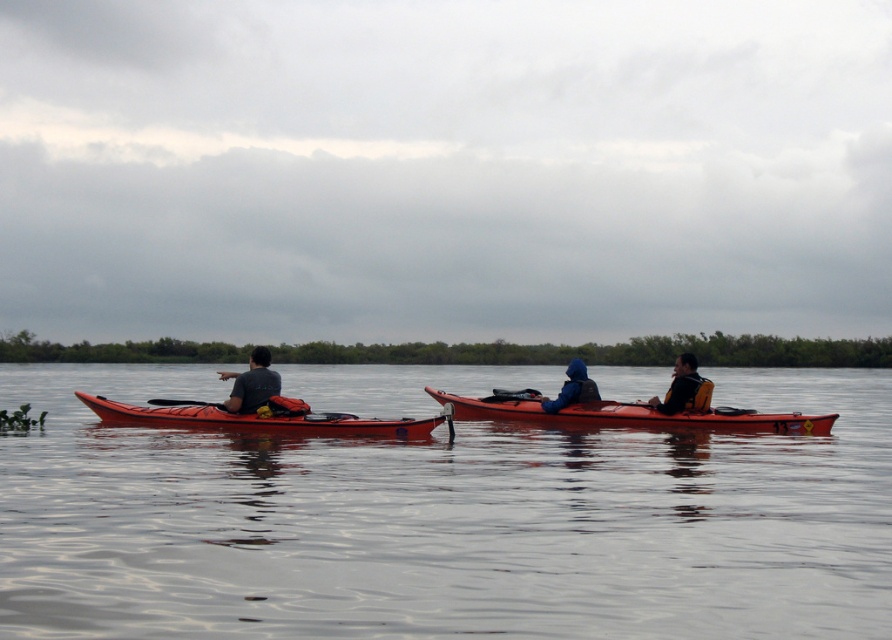
You are standing at the center of the image and want to locate the matte black kayak at left. In which direction should you look?

You should look to the left side of the image to find the matte black kayak at left, as it is positioned at point 0.600 on the x axis and 0.284 on the y axis.

You are planning to take a photo of the matte orange canoe at center and the matte black kayak at left from a position on the shore. Based on their positions, which object will appear lower in the photo?

The matte orange canoe at center appears lower in the photo because it is located below the matte black kayak at left.

You are a drone operator trying to capture the kayakers in the image. The kayakers are in two red kayaks positioned parallel to each other. You need to adjust your drone to focus on the transparent water at center located at point (444, 522). Is the transparent water at center between the two kayaks?

The transparent water at center is located at point (444, 522). Since the two kayaks are positioned parallel to each other, the transparent water at center is likely between them as it is at the central point of the image.